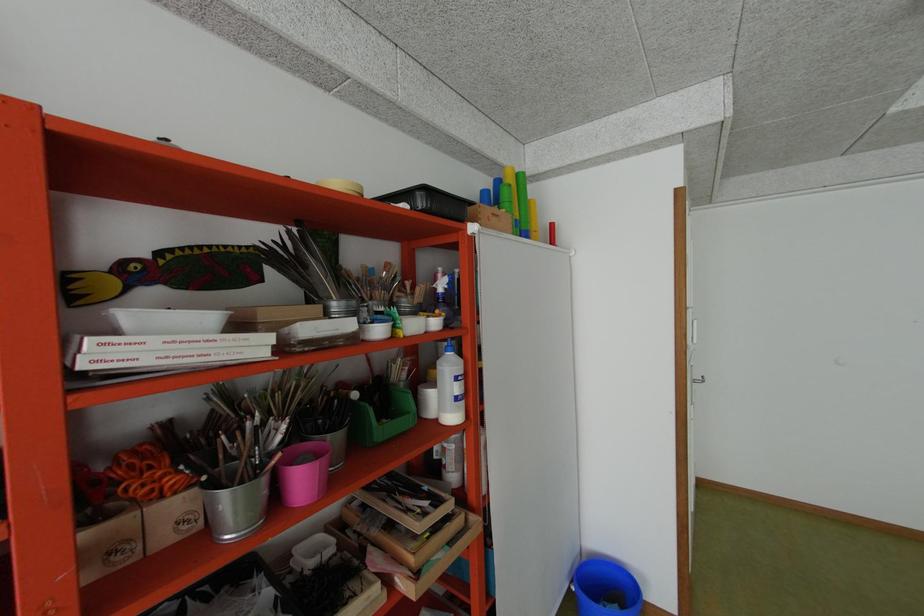
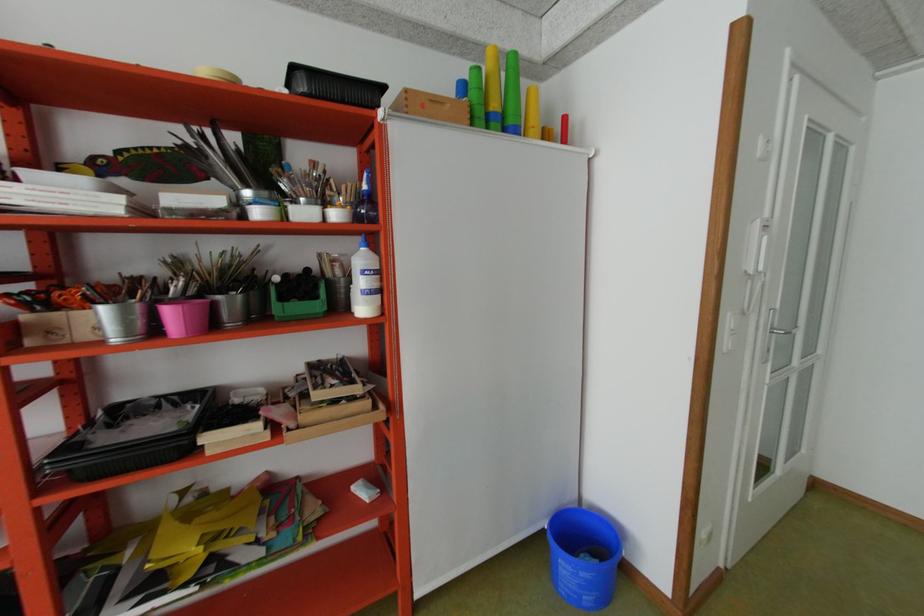
Locate, in the second image, the point that corresponds to [214,589] in the first image.

(185, 398)